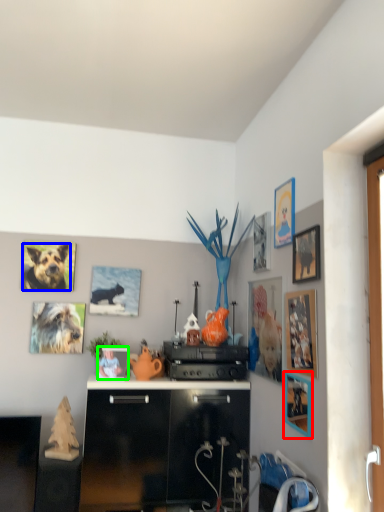
Question: Which object is the farthest from picture frame (highlighted by a red box)? Choose among these: dog (highlighted by a blue box) or picture frame (highlighted by a green box).

Choices:
 (A) dog
 (B) picture frame

Answer: (A)